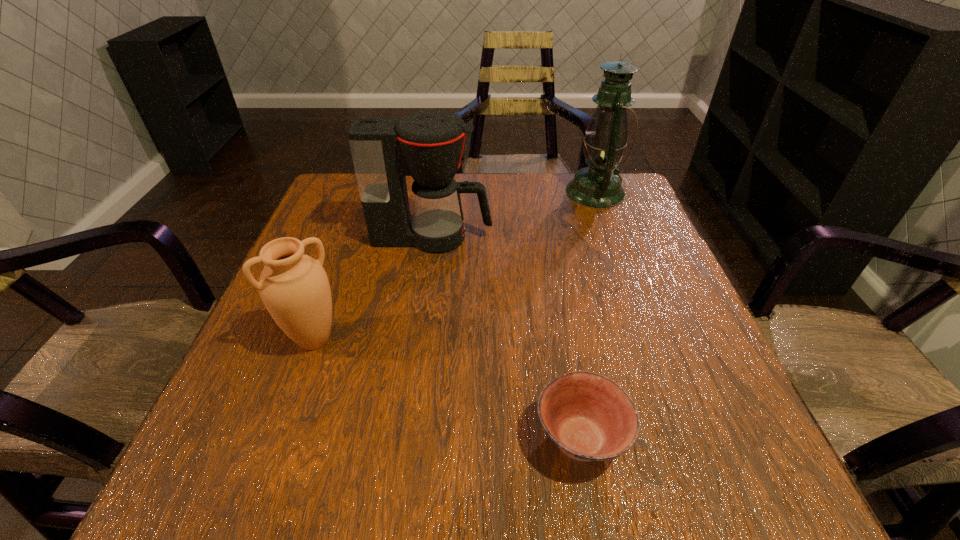
The width and height of the screenshot is (960, 540). Find the location of `blank space at the left edge of the desktop`. blank space at the left edge of the desktop is located at coordinates (355, 287).

Identify the location of free region at the right edge of the desktop. (604, 227).

Where is `vacant space at the far left corner of the desktop`? This screenshot has height=540, width=960. vacant space at the far left corner of the desktop is located at coordinates (334, 195).

The height and width of the screenshot is (540, 960). Find the location of `free space at the far right corner of the desktop`. free space at the far right corner of the desktop is located at coordinates (645, 215).

Locate an element on the screen. This screenshot has height=540, width=960. free space between the coffee maker and the oil lamp is located at coordinates (514, 214).

Where is `vacant area between the second object from right to left and the coffee maker`? vacant area between the second object from right to left and the coffee maker is located at coordinates (506, 338).

You are a GUI agent. You are given a task and a screenshot of the screen. Output one action in this format:
    pyautogui.click(x=<x>, y=<y>)
    Task: Click on the free space between the second tallest object and the bowl
    This screenshot has height=540, width=960.
    Given the screenshot: What is the action you would take?
    pyautogui.click(x=506, y=338)

Where is `empty location between the second shortest object and the coffee maker`? This screenshot has height=540, width=960. empty location between the second shortest object and the coffee maker is located at coordinates (373, 288).

The image size is (960, 540). In order to click on free space between the third shortest object and the urn in this screenshot , I will do `click(373, 288)`.

Locate an element on the screen. free point between the second farthest object and the farthest object is located at coordinates (514, 214).